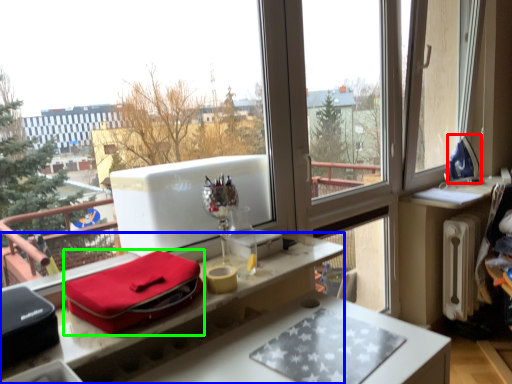
Question: Which object is positioned closest to appliance (highlighted by a red box)? Select from desk (highlighted by a blue box) and package (highlighted by a green box).

Choices:
 (A) desk
 (B) package

Answer: (A)